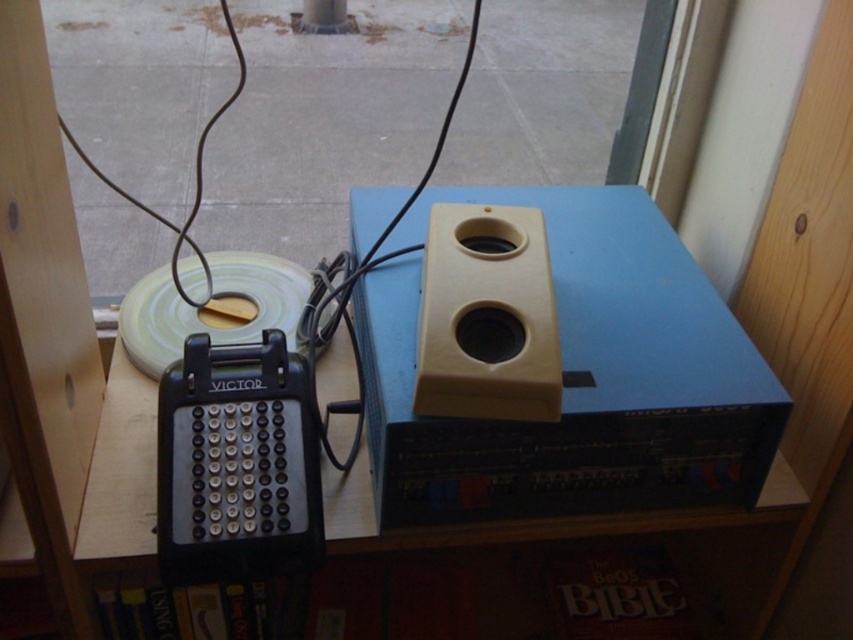
From the picture: You are setting up a small audio setup and need to place the beige plastic speaker at center so that it doesn not block the wooden table at center. Is the speaker short enough to avoid blocking the table?

The beige plastic speaker at center has a lesser height compared to wooden table at center, so it is short enough to avoid blocking the table.

You are setting up a vintage audio setup and need to place the beige plastic speaker at upper center. Based on its position, can you determine if it is positioned above or below the Victor Tape Recorder on the left side?

The beige plastic speaker at upper center is located at point (577, 380), which places it above the Victor Tape Recorder on the left side since it has a higher y coordinate.

You are holding a remote control and want to place it on the beige plastic speaker at upper center. Considering the speaker is 26.78 inches away from you, can you reach it without moving your position?

The beige plastic speaker at upper center is 26.78 inches away from the viewer. If your arm can reach that distance, you can place the remote control on it without moving. Otherwise, you might need to adjust your position.